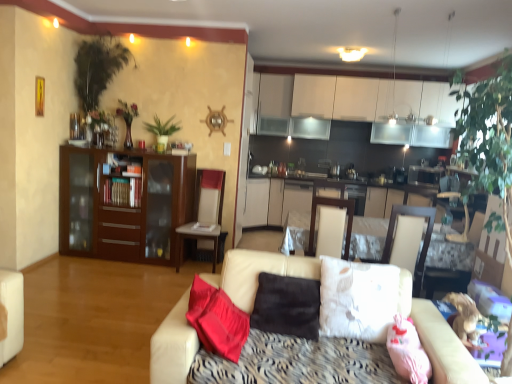
Identify the location of brown suede pillow at center, the first pillow viewed from the left. Image resolution: width=512 pixels, height=384 pixels. (287, 306).

Locate an element on the screen. white leather armchair at center is located at coordinates point(409,241).

Describe the element at coordinates (439, 340) in the screenshot. I see `leather couch at center` at that location.

The image size is (512, 384). Find the location of `green leafy plant at upper center`. green leafy plant at upper center is located at coordinates (162, 131).

This screenshot has height=384, width=512. In order to click on white leather swivel chair at center in this screenshot , I will do `click(332, 206)`.

Describe the element at coordinates (332, 206) in the screenshot. I see `white leather swivel chair at center` at that location.

The height and width of the screenshot is (384, 512). What are the coordinates of `pink fabric pillow at lower right, positioned as the 2th pillow in left-to-right order` in the screenshot? It's located at (407, 351).

Where is `pillow above the pink fabric pillow at lower right, positioned as the 2th pillow in left-to-right order (from a real-world perspective)`? Image resolution: width=512 pixels, height=384 pixels. pillow above the pink fabric pillow at lower right, positioned as the 2th pillow in left-to-right order (from a real-world perspective) is located at coordinates (287, 306).

Is pink fabric pillow at lower right, positioned as the 2th pillow in left-to-right order, not close to brown suede pillow at center, which is the second pillow from right to left?

pink fabric pillow at lower right, positioned as the 2th pillow in left-to-right order, is actually quite close to brown suede pillow at center, which is the second pillow from right to left.

From a real-world perspective, which object rests below the other?

pink fabric pillow at lower right, the first pillow in the right-to-left sequence.

Is pink fabric pillow at lower right, positioned as the 2th pillow in left-to-right order, looking in the opposite direction of brown suede pillow at center, which is the second pillow from right to left?

No, pink fabric pillow at lower right, positioned as the 2th pillow in left-to-right order,'s orientation is not away from brown suede pillow at center, which is the second pillow from right to left.

In order to click on the 1st pillow to the left of the white leather armchair at center, starting your count from the anchor in this screenshot , I will do `click(407, 351)`.

Is pink fabric pillow at lower right, positioned as the 2th pillow in left-to-right order, oriented away from white leather armchair at center?

Yes.

Can you confirm if pink fabric pillow at lower right, the first pillow in the right-to-left sequence, is smaller than white leather armchair at center?

Yes.

How far apart are pink fabric pillow at lower right, positioned as the 2th pillow in left-to-right order, and white leather armchair at center?

They are 1.15 meters apart.

Is white leather chair at center placed right next to green leafy plant at upper center?

They are not placed beside each other.

Can you confirm if white leather chair at center is taller than green leafy plant at upper center?

Yes, white leather chair at center is taller than green leafy plant at upper center.

How many degrees apart are the facing directions of white leather chair at center and green leafy plant at upper center?

0.628 degrees separate the facing orientations of white leather chair at center and green leafy plant at upper center.

Relative to green leafy plant at upper center, is white leather chair at center in front or behind?

white leather chair at center is in front of green leafy plant at upper center.

Considering the relative positions of brown suede pillow at center, which is the second pillow from right to left, and white leather chair at center in the image provided, is brown suede pillow at center, which is the second pillow from right to left, in front of white leather chair at center?

Yes, brown suede pillow at center, which is the second pillow from right to left, is closer to the viewer.

Consider the image. Is brown suede pillow at center, the first pillow viewed from the left, situated inside white leather chair at center or outside?

brown suede pillow at center, the first pillow viewed from the left, is not enclosed by white leather chair at center.

In the scene shown: From the image's perspective, is brown suede pillow at center, the first pillow viewed from the left, positioned above or below white leather chair at center?

Clearly, from the image's perspective, brown suede pillow at center, the first pillow viewed from the left, is below white leather chair at center.

Which of these two, brown suede pillow at center, the first pillow viewed from the left, or white leather chair at center, is wider?

Wider between the two is white leather chair at center.

From a real-world perspective, who is located higher, leather couch at center or white leather chair at center?

In real-world perspective, white leather chair at center is above.

From the image's perspective, does leather couch at center appear higher than white leather chair at center?

Incorrect, from the image's perspective, leather couch at center is lower than white leather chair at center.

Can you confirm if leather couch at center is positioned to the left of white leather chair at center?

In fact, leather couch at center is to the right of white leather chair at center.

Can you confirm if leather couch at center is smaller than white leather chair at center?

Actually, leather couch at center might be larger than white leather chair at center.

From a real-world perspective, who is located higher, green leafy plant at upper center or brown suede pillow at center, which is the second pillow from right to left?

green leafy plant at upper center is physically above.

Is brown suede pillow at center, the first pillow viewed from the left, at the back of green leafy plant at upper center?

green leafy plant at upper center is not turned away from brown suede pillow at center, the first pillow viewed from the left.

How many degrees apart are the facing directions of green leafy plant at upper center and brown suede pillow at center, the first pillow viewed from the left?

green leafy plant at upper center and brown suede pillow at center, the first pillow viewed from the left, are facing 2.83 degrees away from each other.

In terms of width, does green leafy plant at upper center look wider or thinner when compared to brown suede pillow at center, the first pillow viewed from the left?

Considering their sizes, green leafy plant at upper center looks slimmer than brown suede pillow at center, the first pillow viewed from the left.

Which is behind, white leather swivel chair at center or brown suede pillow at center, which is the second pillow from right to left?

white leather swivel chair at center is further from the camera.

Does white leather swivel chair at center turn towards brown suede pillow at center, the first pillow viewed from the left?

No, white leather swivel chair at center is not oriented towards brown suede pillow at center, the first pillow viewed from the left.

Do you think white leather swivel chair at center is within brown suede pillow at center, the first pillow viewed from the left, or outside of it?

white leather swivel chair at center is outside brown suede pillow at center, the first pillow viewed from the left.

Considering the points (346, 252) and (253, 327), which point is behind, point (346, 252) or point (253, 327)?

Positioned behind is point (346, 252).

This screenshot has height=384, width=512. Identify the location of pillow below the brown suede pillow at center, the first pillow viewed from the left (from a real-world perspective). (407, 351).

I want to click on armchair above the pink fabric pillow at lower right, positioned as the 2th pillow in left-to-right order (from the image's perspective), so click(x=409, y=241).

When comparing their distances from white leather swivel chair at center, does brown suede pillow at center, which is the second pillow from right to left, or white leather chair at center seem further?

Based on the image, white leather chair at center appears to be further to white leather swivel chair at center.

Based on their spatial positions, is brown suede pillow at center, which is the second pillow from right to left, or white leather armchair at center further from white leather swivel chair at center?

brown suede pillow at center, which is the second pillow from right to left.

Estimate the real-world distances between objects in this image. Which object is closer to brown wood cabinet at left, white leather chair at center or white leather swivel chair at center?

white leather chair at center is closer to brown wood cabinet at left.

Which object lies further to the anchor point pink fabric pillow at lower right, positioned as the 2th pillow in left-to-right order, leather couch at center or white leather armchair at center?

The object further to pink fabric pillow at lower right, positioned as the 2th pillow in left-to-right order, is white leather armchair at center.

Based on the photo, based on their spatial positions, is pink fabric pillow at lower right, the first pillow in the right-to-left sequence, or white leather chair at center further from white leather swivel chair at center?

white leather chair at center.

Which object lies nearer to the anchor point brown suede pillow at center, the first pillow viewed from the left, leather couch at center or green leafy plant at upper center?

Among the two, leather couch at center is located nearer to brown suede pillow at center, the first pillow viewed from the left.

When comparing their distances from white leather chair at center, does brown wood cabinet at left or white leather armchair at center seem closer?

Among the two, brown wood cabinet at left is located nearer to white leather chair at center.

From the image, which object appears to be farther from brown suede pillow at center, which is the second pillow from right to left, pink fabric pillow at lower right, positioned as the 2th pillow in left-to-right order, or brown wood cabinet at left?

brown wood cabinet at left is further to brown suede pillow at center, which is the second pillow from right to left.

The height and width of the screenshot is (384, 512). In order to click on cabinetry between pink fabric pillow at lower right, the first pillow in the right-to-left sequence, and green leafy plant at upper center from front to back in this screenshot , I will do `click(123, 204)`.

Image resolution: width=512 pixels, height=384 pixels. I want to click on chair between brown suede pillow at center, which is the second pillow from right to left, and green leafy plant at upper center in the front-back direction, so click(x=205, y=215).

Image resolution: width=512 pixels, height=384 pixels. I want to click on chair between brown wood cabinet at left and white leather swivel chair at center in the horizontal direction, so click(205, 215).

Identify the location of swivel chair between white leather chair at center and white leather armchair at center from left to right. The height and width of the screenshot is (384, 512). (332, 206).